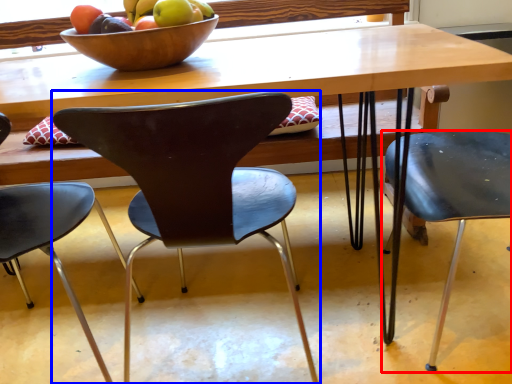
Question: Which of the following is the closest to the observer, chair (highlighted by a red box) or chair (highlighted by a blue box)?

Choices:
 (A) chair
 (B) chair

Answer: (B)